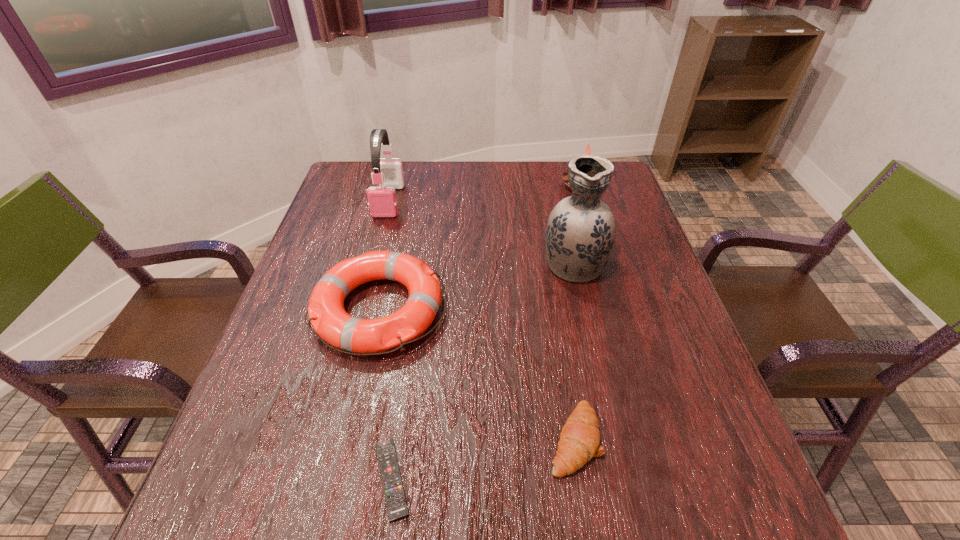
Find the location of a particular element. This screenshot has width=960, height=540. the tallest object is located at coordinates (580, 233).

The width and height of the screenshot is (960, 540). Identify the location of earphone. (382, 201).

At what (x,y) coordinates should I click in order to perform the action: click on the third tallest object. Please return your answer as a coordinate pair (x, y). The image size is (960, 540). Looking at the image, I should click on (564, 176).

The width and height of the screenshot is (960, 540). Find the location of `life buoy`. life buoy is located at coordinates (327, 315).

The height and width of the screenshot is (540, 960). In order to click on the second shortest object in this screenshot , I will do `click(579, 441)`.

The image size is (960, 540). What are the coordinates of `remote control` in the screenshot? It's located at (395, 499).

Find the location of a particular element. The height and width of the screenshot is (540, 960). blank space located 0.360m with the handle on the side of the tallest object is located at coordinates (553, 171).

Locate an element on the screen. This screenshot has height=540, width=960. free space located 0.320m with the handle on the side of the tallest object is located at coordinates (554, 177).

Locate an element on the screen. This screenshot has height=540, width=960. free location located 0.360m with the handle on the side of the tallest object is located at coordinates (553, 171).

Image resolution: width=960 pixels, height=540 pixels. In order to click on vacant space located on the outer surface of the fifth shortest object in this screenshot , I will do `click(374, 259)`.